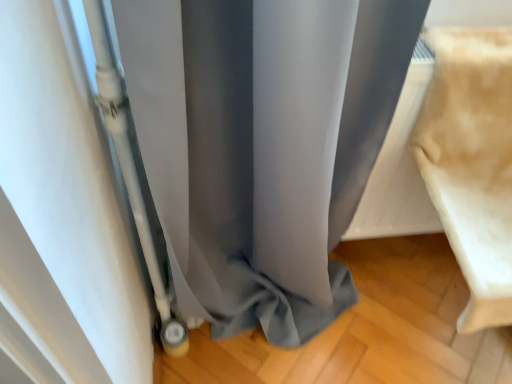
Where is `beige fabric cushion at right`? beige fabric cushion at right is located at coordinates (472, 163).

The width and height of the screenshot is (512, 384). What do you see at coordinates (472, 163) in the screenshot?
I see `beige fabric cushion at right` at bounding box center [472, 163].

Find the location of a particular element. This screenshot has width=512, height=384. matte gray curtain at center is located at coordinates click(263, 145).

What do you see at coordinates (263, 145) in the screenshot?
I see `matte gray curtain at center` at bounding box center [263, 145].

In order to face matte gray curtain at center, should I rotate leftwards or rightwards?

To face it directly, rotate right by 1.765 degrees.

The image size is (512, 384). I want to click on beige fabric cushion at right, so click(472, 163).

Is matte gray curtain at center to the right of beige fabric cushion at right from the viewer's perspective?

No.

Which is behind, matte gray curtain at center or beige fabric cushion at right?

beige fabric cushion at right is further away from the camera.

Considering the points (207, 125) and (503, 33), which point is in front, point (207, 125) or point (503, 33)?

The point (207, 125) is closer to the camera.

From the image's perspective, which is above, matte gray curtain at center or beige fabric cushion at right?

beige fabric cushion at right.

From a real-world perspective, is matte gray curtain at center physically located above or below beige fabric cushion at right?

From a real-world perspective, matte gray curtain at center is physically below beige fabric cushion at right.

Looking at their sizes, would you say matte gray curtain at center is wider or thinner than beige fabric cushion at right?

Considering their sizes, matte gray curtain at center looks slimmer than beige fabric cushion at right.

Who is shorter, matte gray curtain at center or beige fabric cushion at right?

Standing shorter between the two is beige fabric cushion at right.

Considering the relative sizes of matte gray curtain at center and beige fabric cushion at right in the image provided, is matte gray curtain at center smaller than beige fabric cushion at right?

No, matte gray curtain at center is not smaller than beige fabric cushion at right.

Is matte gray curtain at center inside or outside of beige fabric cushion at right?

matte gray curtain at center is located beyond the bounds of beige fabric cushion at right.

Does matte gray curtain at center touch beige fabric cushion at right?

No, matte gray curtain at center is not making contact with beige fabric cushion at right.

Is matte gray curtain at center oriented towards beige fabric cushion at right?

No, matte gray curtain at center is not facing towards beige fabric cushion at right.

How far apart are matte gray curtain at center and beige fabric cushion at right?

13.90 inches.

Where is `curtain directly beneath the beige fabric cushion at right (from a real-world perspective)`? curtain directly beneath the beige fabric cushion at right (from a real-world perspective) is located at coordinates (263, 145).

Is beige fabric cushion at right to the left or to the right of matte gray curtain at center in the image?

In the image, beige fabric cushion at right appears on the right side of matte gray curtain at center.

Is beige fabric cushion at right positioned behind matte gray curtain at center?

Yes.

Which is behind, point (496, 66) or point (334, 242)?

The point (334, 242) is farther.

From the image's perspective, which one is positioned lower, beige fabric cushion at right or matte gray curtain at center?

From the image's view, matte gray curtain at center is below.

From a real-world perspective, is beige fabric cushion at right below matte gray curtain at center?

Incorrect, from a real-world perspective, beige fabric cushion at right is higher than matte gray curtain at center.

Which object is thinner, beige fabric cushion at right or matte gray curtain at center?

Thinner between the two is matte gray curtain at center.

Which of these two, beige fabric cushion at right or matte gray curtain at center, stands shorter?

Standing shorter between the two is beige fabric cushion at right.

Considering the sizes of beige fabric cushion at right and matte gray curtain at center in the image, is beige fabric cushion at right bigger or smaller than matte gray curtain at center?

beige fabric cushion at right is smaller than matte gray curtain at center.

Is beige fabric cushion at right outside of matte gray curtain at center?

Indeed, beige fabric cushion at right is completely outside matte gray curtain at center.

Based on the photo, is there a large distance between beige fabric cushion at right and matte gray curtain at center?

No, beige fabric cushion at right is in close proximity to matte gray curtain at center.

Is beige fabric cushion at right aimed at matte gray curtain at center?

No, beige fabric cushion at right is not facing towards matte gray curtain at center.

Measure the distance between beige fabric cushion at right and matte gray curtain at center.

They are 13.90 inches apart.

Identify the location of curtain in front of the beige fabric cushion at right. Image resolution: width=512 pixels, height=384 pixels. (263, 145).

Find the location of a particular element. furniture lying above the matte gray curtain at center (from the image's perspective) is located at coordinates (472, 163).

This screenshot has height=384, width=512. Identify the location of curtain in front of the beige fabric cushion at right. (263, 145).